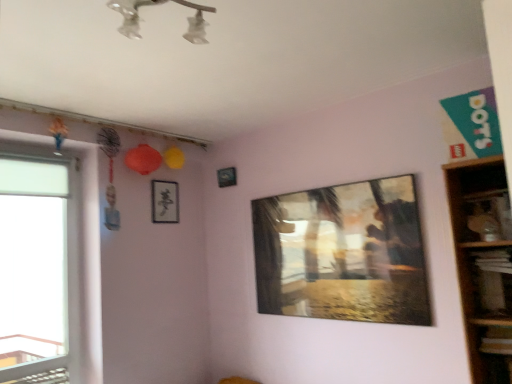
Measure the distance between point (x=227, y=170) and camera.

The distance of point (x=227, y=170) from camera is 10.94 feet.

What is the approximate width of wooden shelf at right?

wooden shelf at right is 13.92 inches wide.

What is the approximate height of transparent glass window at left?

The height of transparent glass window at left is 1.46 meters.

Describe the element at coordinates (165, 202) in the screenshot. I see `black paper at upper center, the second picture frame viewed from the back` at that location.

What are the coordinates of `metallic rectangular frame at upper center, which is the second picture frame in left-to-right order` in the screenshot? It's located at (227, 177).

How different are the orientations of metallic reflective painting at center, which is the third picture frame in back-to-front order, and wooden shelf at right in degrees?

metallic reflective painting at center, which is the third picture frame in back-to-front order, and wooden shelf at right are facing 1.04 degrees away from each other.

Is metallic reflective painting at center, the first picture frame from the front, facing towards wooden shelf at right?

No, metallic reflective painting at center, the first picture frame from the front, is not oriented towards wooden shelf at right.

Is metallic reflective painting at center, the first picture frame from the front, in contact with wooden shelf at right?

There is a gap between metallic reflective painting at center, the first picture frame from the front, and wooden shelf at right.

Can you confirm if metallic reflective painting at center, which is the first picture frame in right-to-left order, is wider than wooden shelf at right?

Incorrect, the width of metallic reflective painting at center, which is the first picture frame in right-to-left order, does not surpass that of wooden shelf at right.

What's the angular difference between transparent glass window at left and wooden shelf at right's facing directions?

The angular difference between transparent glass window at left and wooden shelf at right is 91.7 degrees.

Is transparent glass window at left facing towards wooden shelf at right?

No, transparent glass window at left is not oriented towards wooden shelf at right.

Considering the positions of objects transparent glass window at left and wooden shelf at right in the image provided, who is behind, transparent glass window at left or wooden shelf at right?

transparent glass window at left is behind.

Considering the sizes of objects transparent glass window at left and wooden shelf at right in the image provided, who is bigger, transparent glass window at left or wooden shelf at right?

Bigger between the two is wooden shelf at right.

Considering the positions of point (172, 202) and point (475, 173), is point (172, 202) closer or farther from the camera than point (475, 173)?

Point (172, 202).

Identify the location of shelf beneath the black paper at upper center, the 3th picture frame when ordered from right to left (from a real-world perspective). This screenshot has height=384, width=512. (483, 262).

From the image's perspective, is black paper at upper center, the second picture frame viewed from the back, positioned above or below wooden shelf at right?

black paper at upper center, the second picture frame viewed from the back, is situated higher than wooden shelf at right in the image.

Looking at this image, in terms of size, does black paper at upper center, arranged as the 2th picture frame when viewed from the front, appear bigger or smaller than wooden shelf at right?

Considering their sizes, black paper at upper center, arranged as the 2th picture frame when viewed from the front, takes up less space than wooden shelf at right.

Is transparent glass window at left completely or partially outside of black paper at upper center, the 3th picture frame when ordered from right to left?

Yes, transparent glass window at left is not within black paper at upper center, the 3th picture frame when ordered from right to left.

From the image's perspective, who appears lower, transparent glass window at left or black paper at upper center, arranged as the 2th picture frame when viewed from the front?

transparent glass window at left is shown below in the image.

Can you tell me how much transparent glass window at left and black paper at upper center, the 3th picture frame when ordered from right to left, differ in facing direction?

The angular difference between transparent glass window at left and black paper at upper center, the 3th picture frame when ordered from right to left, is 0.974 degrees.

Is transparent glass window at left bigger than black paper at upper center, the second picture frame viewed from the back?

Correct, transparent glass window at left is larger in size than black paper at upper center, the second picture frame viewed from the back.

Which of these two, wooden shelf at right or black paper at upper center, which appears as the first picture frame when viewed from the left, stands taller?

wooden shelf at right.

From a real-world perspective, which object stands above the other?

In real-world perspective, black paper at upper center, the second picture frame viewed from the back, is above.

Is wooden shelf at right positioned beyond the bounds of black paper at upper center, the 3th picture frame when ordered from right to left?

Yes, wooden shelf at right is located beyond the bounds of black paper at upper center, the 3th picture frame when ordered from right to left.

Between wooden shelf at right and black paper at upper center, the 3th picture frame when ordered from right to left, which one appears on the left side from the viewer's perspective?

From the viewer's perspective, black paper at upper center, the 3th picture frame when ordered from right to left, appears more on the left side.

From a real-world perspective, between transparent glass window at left and metallic reflective painting at center, the first picture frame from the front, who is vertically higher?

transparent glass window at left.

How different are the orientations of transparent glass window at left and metallic reflective painting at center, the first picture frame from the front, in degrees?

The angle between the facing direction of transparent glass window at left and the facing direction of metallic reflective painting at center, the first picture frame from the front, is 90.6 degrees.

At what (x,y) coordinates should I click in order to perform the action: click on picture frame in front of the transparent glass window at left. Please return your answer as a coordinate pair (x, y). This screenshot has height=384, width=512. Looking at the image, I should click on (343, 253).

Considering the positions of points (387, 220) and (26, 180), is point (387, 220) closer to camera compared to point (26, 180)?

Yes, point (387, 220) is closer to viewer.

Considering the sizes of objects metallic reflective painting at center, which is the first picture frame in right-to-left order, and transparent glass window at left in the image provided, who is shorter, metallic reflective painting at center, which is the first picture frame in right-to-left order, or transparent glass window at left?

metallic reflective painting at center, which is the first picture frame in right-to-left order, is shorter.

Is metallic reflective painting at center, which is the third picture frame in back-to-front order, to the left or to the right of transparent glass window at left in the image?

metallic reflective painting at center, which is the third picture frame in back-to-front order, is positioned on transparent glass window at left's right side.

From the image's perspective, relative to transparent glass window at left, is metallic reflective painting at center, which is the first picture frame in right-to-left order, above or below?

Clearly, from the image's perspective, metallic reflective painting at center, which is the first picture frame in right-to-left order, is above transparent glass window at left.

Locate an element on the screen. The image size is (512, 384). shelf below the metallic reflective painting at center, the 3th picture frame positioned from the left (from a real-world perspective) is located at coordinates (483, 262).

You are a GUI agent. You are given a task and a screenshot of the screen. Output one action in this format:
    pyautogui.click(x=<x>, y=<y>)
    Task: Click on the window behind the wooden shelf at right
    The image size is (512, 384).
    Given the screenshot: What is the action you would take?
    pyautogui.click(x=40, y=262)

When comparing their distances from black paper at upper center, the 3th picture frame when ordered from right to left, does metallic rectangular frame at upper center, which is the second picture frame from right to left, or metallic reflective painting at center, which is the third picture frame in back-to-front order, seem further?

metallic reflective painting at center, which is the third picture frame in back-to-front order, is further to black paper at upper center, the 3th picture frame when ordered from right to left.

From the image, which object appears to be farther from metallic rectangular frame at upper center, the 1th picture frame in the back-to-front sequence, wooden shelf at right or black paper at upper center, which appears as the first picture frame when viewed from the left?

wooden shelf at right lies further to metallic rectangular frame at upper center, the 1th picture frame in the back-to-front sequence, than the other object.

Which object lies further to the anchor point black paper at upper center, the second picture frame viewed from the back, metallic reflective painting at center, which is the third picture frame in back-to-front order, or transparent glass window at left?

Based on the image, metallic reflective painting at center, which is the third picture frame in back-to-front order, appears to be further to black paper at upper center, the second picture frame viewed from the back.

Based on their spatial positions, is metallic rectangular frame at upper center, the 1th picture frame in the back-to-front sequence, or transparent glass window at left further from wooden shelf at right?

Among the two, transparent glass window at left is located further to wooden shelf at right.

When comparing their distances from metallic rectangular frame at upper center, which is the second picture frame from right to left, does transparent glass window at left or metallic reflective painting at center, which is the first picture frame in right-to-left order, seem closer?

metallic reflective painting at center, which is the first picture frame in right-to-left order.

Which object lies nearer to the anchor point metallic rectangular frame at upper center, which ranks as the 3th picture frame in front-to-back order, metallic reflective painting at center, the first picture frame from the front, or black paper at upper center, arranged as the 2th picture frame when viewed from the front?

black paper at upper center, arranged as the 2th picture frame when viewed from the front, is positioned closer to the anchor metallic rectangular frame at upper center, which ranks as the 3th picture frame in front-to-back order.

Considering their positions, is metallic reflective painting at center, which is the third picture frame in back-to-front order, positioned closer to metallic rectangular frame at upper center, the 1th picture frame in the back-to-front sequence, than wooden shelf at right?

metallic reflective painting at center, which is the third picture frame in back-to-front order, is closer to metallic rectangular frame at upper center, the 1th picture frame in the back-to-front sequence.

Looking at the image, which one is located further to metallic rectangular frame at upper center, which is the second picture frame in left-to-right order, transparent glass window at left or black paper at upper center, arranged as the 2th picture frame when viewed from the front?

The object further to metallic rectangular frame at upper center, which is the second picture frame in left-to-right order, is transparent glass window at left.

Locate an element on the screen. picture frame between transparent glass window at left and metallic rectangular frame at upper center, which ranks as the 3th picture frame in front-to-back order, in the horizontal direction is located at coordinates (165, 202).

Where is `picture frame situated between black paper at upper center, arranged as the 2th picture frame when viewed from the front, and metallic reflective painting at center, which is the first picture frame in right-to-left order, from left to right`? This screenshot has height=384, width=512. picture frame situated between black paper at upper center, arranged as the 2th picture frame when viewed from the front, and metallic reflective painting at center, which is the first picture frame in right-to-left order, from left to right is located at coordinates (227, 177).